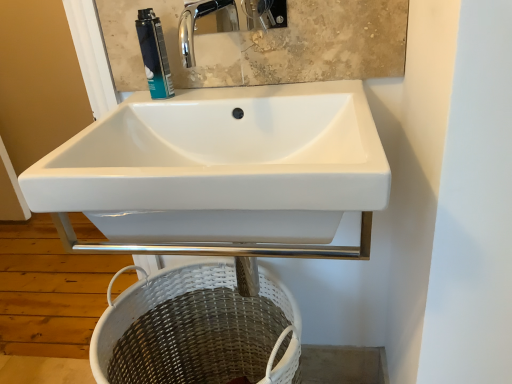
Find the location of a particular element. This screenshot has width=512, height=384. white glossy sink at center is located at coordinates (221, 174).

This screenshot has height=384, width=512. Find the location of `white wicker basket at lower center`. white wicker basket at lower center is located at coordinates (197, 330).

What is the approximate height of blue metallic can at upper center?

blue metallic can at upper center is 7.10 inches tall.

Identify the location of white glossy sink at center. The width and height of the screenshot is (512, 384). (221, 174).

Is white glossy sink at center touching white wicker basket at lower center?

They are not placed beside each other.

Is white glossy sink at center turned away from white wicker basket at lower center?

No, white glossy sink at center is not facing the opposite direction of white wicker basket at lower center.

Find the location of a particular element. basket lying below the white glossy sink at center (from the image's perspective) is located at coordinates (197, 330).

Is white glossy sink at center taller than white wicker basket at lower center?

No, white glossy sink at center is not taller than white wicker basket at lower center.

Is point (149, 21) positioned after point (354, 208)?

Yes, it is.

Is white glossy sink at center at the back of blue metallic can at upper center?

No, blue metallic can at upper center is not facing away from white glossy sink at center.

Identify the location of sink in front of the blue metallic can at upper center. The image size is (512, 384). (221, 174).

Can we say white glossy sink at center lies outside blue metallic can at upper center?

white glossy sink at center is positioned outside blue metallic can at upper center.

Which is in front, point (362, 117) or point (156, 88)?

The point (362, 117) is closer to the camera.

From a real-world perspective, between white glossy sink at center and blue metallic can at upper center, who is vertically lower?

In real-world perspective, white glossy sink at center is lower.

Is white glossy sink at center touching blue metallic can at upper center?

No, white glossy sink at center is not making contact with blue metallic can at upper center.

Choose the correct answer: Is white wicker basket at lower center inside white glossy sink at center or outside it?

white wicker basket at lower center is not enclosed by white glossy sink at center.

From a real-world perspective, is white wicker basket at lower center below white glossy sink at center?

Yes, from a real-world perspective, white wicker basket at lower center is below white glossy sink at center.

Based on their sizes in the image, would you say white wicker basket at lower center is bigger or smaller than white glossy sink at center?

white wicker basket at lower center is bigger than white glossy sink at center.

Who is shorter, blue metallic can at upper center or white wicker basket at lower center?

blue metallic can at upper center is shorter.

From a real-world perspective, who is located lower, blue metallic can at upper center or white wicker basket at lower center?

white wicker basket at lower center is physically lower.

Is blue metallic can at upper center oriented away from white wicker basket at lower center?

No, white wicker basket at lower center is not at the back of blue metallic can at upper center.

The image size is (512, 384). Identify the location of toiletry that appears above the white wicker basket at lower center (from the image's perspective). (154, 54).

Is point (134, 285) closer to viewer compared to point (138, 39)?

No, (134, 285) is behind (138, 39).

Visually, is white wicker basket at lower center positioned to the left or to the right of blue metallic can at upper center?

In the image, white wicker basket at lower center appears on the right side of blue metallic can at upper center.

Where is `sink lying above the white wicker basket at lower center (from the image's perspective)`? sink lying above the white wicker basket at lower center (from the image's perspective) is located at coordinates (221, 174).

The width and height of the screenshot is (512, 384). In order to click on toiletry on the left of white glossy sink at center in this screenshot , I will do `click(154, 54)`.

Looking at the image, which one is located further to blue metallic can at upper center, white wicker basket at lower center or white glossy sink at center?

Among the two, white wicker basket at lower center is located further to blue metallic can at upper center.

Estimate the real-world distances between objects in this image. Which object is closer to blue metallic can at upper center, white glossy sink at center or white wicker basket at lower center?

Among the two, white glossy sink at center is located nearer to blue metallic can at upper center.

Estimate the real-world distances between objects in this image. Which object is further from white glossy sink at center, blue metallic can at upper center or white wicker basket at lower center?

white wicker basket at lower center is positioned further to the anchor white glossy sink at center.

Looking at the image, which one is located further to white wicker basket at lower center, white glossy sink at center or blue metallic can at upper center?

The object further to white wicker basket at lower center is blue metallic can at upper center.

Based on their spatial positions, is blue metallic can at upper center or white glossy sink at center closer to white wicker basket at lower center?

white glossy sink at center.

Considering their positions, is white wicker basket at lower center positioned further to white glossy sink at center than blue metallic can at upper center?

Among the two, white wicker basket at lower center is located further to white glossy sink at center.

Find the location of a particular element. This screenshot has height=384, width=512. sink between blue metallic can at upper center and white wicker basket at lower center in the up-down direction is located at coordinates (221, 174).